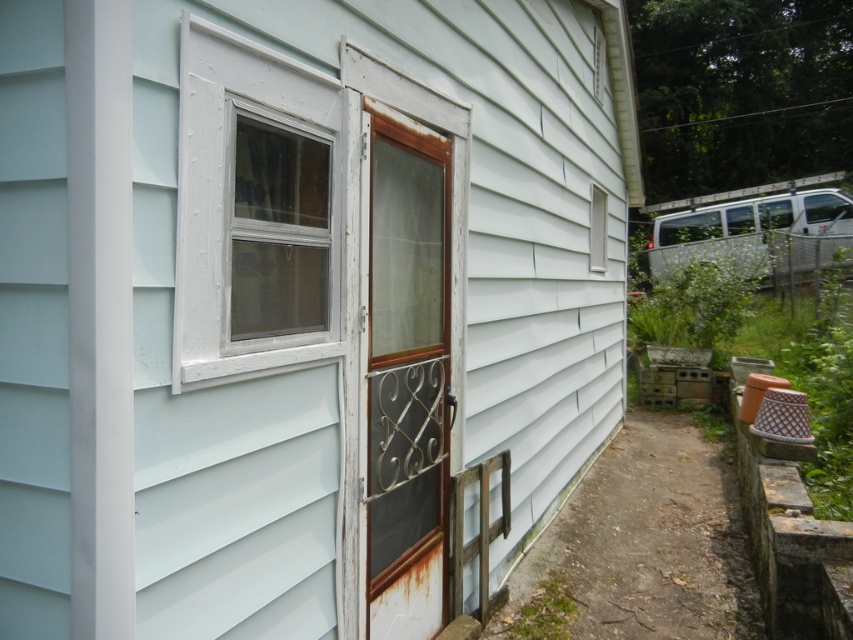
You are a painter who needs to touch up the windows on the light blue house. You see the white plastic window at upper left and the clear glass window at upper left. Which window is positioned higher up on the house?

The white plastic window at upper left is located above the clear glass window at upper left, so it is positioned higher up on the house.

From the picture: You are a painter standing 20 inches away from the light blue siding at center. You want to paint the clear glass window at upper left but need to know if you can reach it without moving closer. Can you reach it?

The light blue siding at center is 18.11 inches away from the clear glass window at upper left. Since you are already 20 inches away from the siding, the total distance to the window would be 18.11 plus 20 inches, totaling 38.11 inches. Therefore, you cannot reach the clear glass window at upper left without moving closer.

From the picture: You are standing in front of the light blue house. There is a point marked at coordinates (299, 301). What object is located at this point?

The point at coordinates (299, 301) marks light blue siding at center.